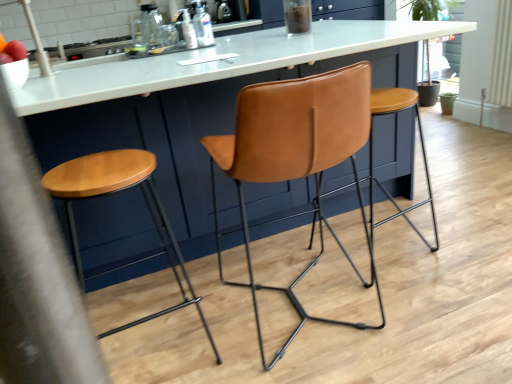
Locate an element on the screen. This screenshot has width=512, height=384. free space behind leather stool at center, the 1th stool in the right-to-left sequence is located at coordinates (371, 215).